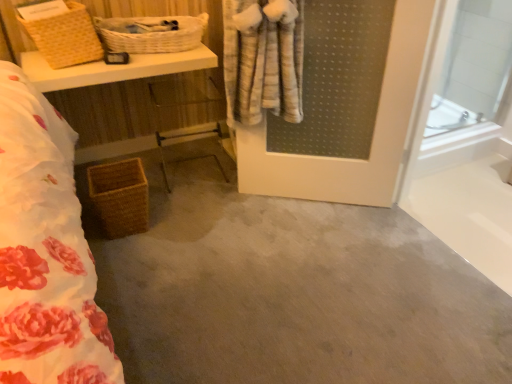
The image size is (512, 384). I want to click on free space on the front side of woven brown basket at lower left, which is counted as the 1th basket, starting from the bottom, so click(123, 256).